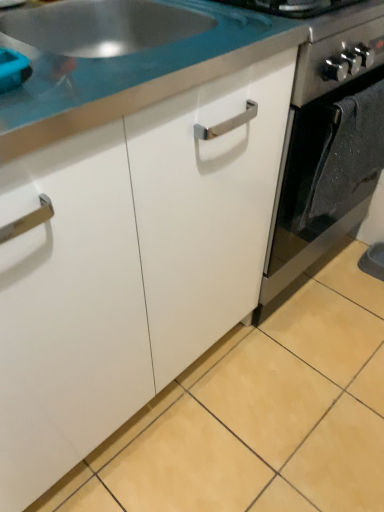
You are a GUI agent. You are given a task and a screenshot of the screen. Output one action in this format:
    pyautogui.click(x=<x>, y=<y>)
    Task: Click on the white glossy countertop at upper center
    The height and width of the screenshot is (512, 384).
    Given the screenshot: What is the action you would take?
    pyautogui.click(x=132, y=76)

This screenshot has width=384, height=512. Describe the element at coordinates (132, 76) in the screenshot. I see `white glossy countertop at upper center` at that location.

Locate an element on the screen. This screenshot has height=512, width=384. satin black oven at center is located at coordinates click(x=317, y=157).

Describe the element at coordinates (317, 157) in the screenshot. This screenshot has width=384, height=512. I see `satin black oven at center` at that location.

Locate an element on the screen. This screenshot has height=512, width=384. white glossy countertop at upper center is located at coordinates (132, 76).

Considering the relative positions of satin black oven at center and white glossy countertop at upper center in the image provided, is satin black oven at center to the left or to the right of white glossy countertop at upper center?

satin black oven at center is to the right of white glossy countertop at upper center.

Between satin black oven at center and white glossy countertop at upper center, which one is positioned behind?

satin black oven at center.

Is point (292, 143) positioned behind point (292, 30)?

Yes.

In the scene shown: From the image's perspective, which is below, satin black oven at center or white glossy countertop at upper center?

satin black oven at center, from the image's perspective.

From a real-world perspective, which is physically below, satin black oven at center or white glossy countertop at upper center?

From a 3D spatial view, satin black oven at center is below.

Considering the relative sizes of satin black oven at center and white glossy countertop at upper center in the image provided, is satin black oven at center thinner than white glossy countertop at upper center?

In fact, satin black oven at center might be wider than white glossy countertop at upper center.

Considering the relative sizes of satin black oven at center and white glossy countertop at upper center in the image provided, is satin black oven at center shorter than white glossy countertop at upper center?

Incorrect, the height of satin black oven at center does not fall short of that of white glossy countertop at upper center.

Looking at this image, can you confirm if satin black oven at center is bigger than white glossy countertop at upper center?

Yes, satin black oven at center is bigger than white glossy countertop at upper center.

Is satin black oven at center not within white glossy countertop at upper center?

satin black oven at center lies outside white glossy countertop at upper center's area.

Is satin black oven at center in contact with white glossy countertop at upper center?

They are not placed beside each other.

Could you tell me if satin black oven at center is facing white glossy countertop at upper center?

No, satin black oven at center is not oriented towards white glossy countertop at upper center.

Can you tell me how much satin black oven at center and white glossy countertop at upper center differ in facing direction?

They differ by 1.33 degrees in their facing directions.

Measure the distance from satin black oven at center to white glossy countertop at upper center.

satin black oven at center is 14.68 inches away from white glossy countertop at upper center.

The width and height of the screenshot is (384, 512). I want to click on countertop located on the left of satin black oven at center, so click(x=132, y=76).

Which is more to the left, white glossy countertop at upper center or satin black oven at center?

white glossy countertop at upper center is more to the left.

Is white glossy countertop at upper center positioned before satin black oven at center?

Yes.

Does point (87, 99) lie in front of point (321, 249)?

That is True.

From the image's perspective, is white glossy countertop at upper center above or below satin black oven at center?

white glossy countertop at upper center is above satin black oven at center.

From a real-world perspective, does white glossy countertop at upper center sit lower than satin black oven at center?

No, from a real-world perspective, white glossy countertop at upper center is not under satin black oven at center.

Which object is thinner, white glossy countertop at upper center or satin black oven at center?

white glossy countertop at upper center.

Between white glossy countertop at upper center and satin black oven at center, which one has more height?

With more height is satin black oven at center.

Does white glossy countertop at upper center have a smaller size compared to satin black oven at center?

Yes, white glossy countertop at upper center is smaller than satin black oven at center.

Is white glossy countertop at upper center inside the boundaries of satin black oven at center, or outside?

white glossy countertop at upper center is located beyond the bounds of satin black oven at center.

Is white glossy countertop at upper center far from satin black oven at center?

They are positioned close to each other.

Is white glossy countertop at upper center aimed at satin black oven at center?

No.

Can you tell me how much white glossy countertop at upper center and satin black oven at center differ in facing direction?

The angular difference between white glossy countertop at upper center and satin black oven at center is 1.33 degrees.

In the image, there is a white glossy countertop at upper center. Identify the location of oven below it (from a real-world perspective). The width and height of the screenshot is (384, 512). (317, 157).

At what (x,y) coordinates should I click in order to perform the action: click on oven located behind the white glossy countertop at upper center. Please return your answer as a coordinate pair (x, y). Looking at the image, I should click on (317, 157).

The image size is (384, 512). What are the coordinates of `oven on the right of white glossy countertop at upper center` in the screenshot? It's located at (317, 157).